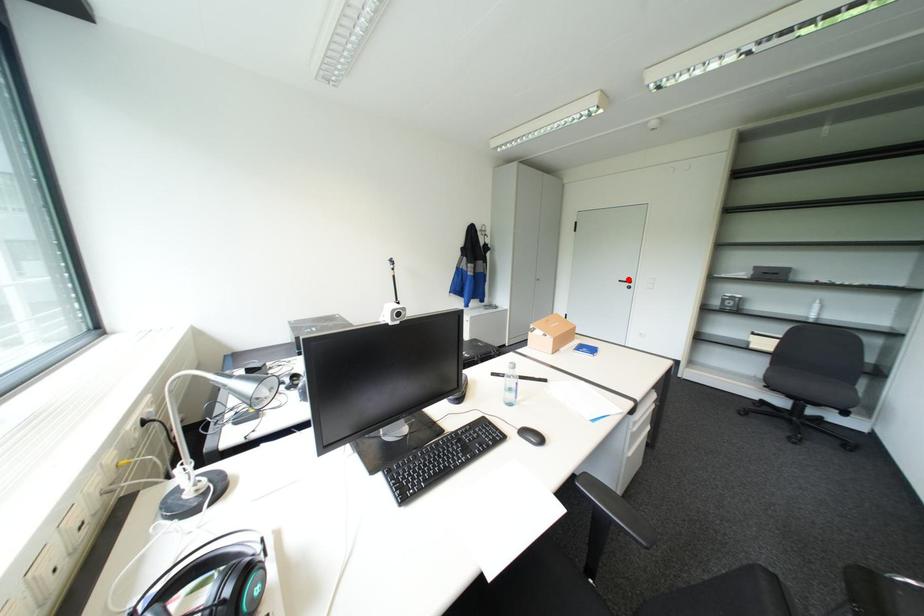
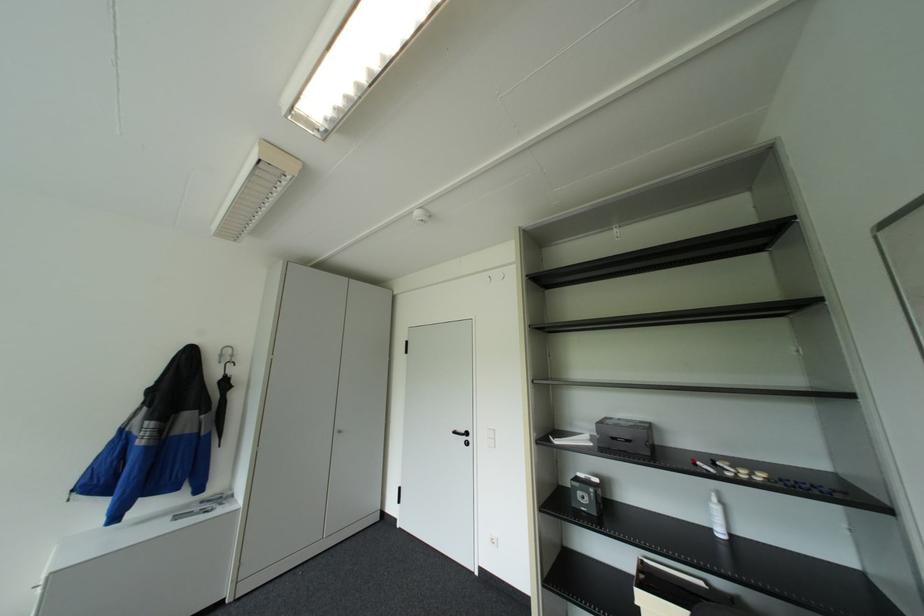
Question: I am providing you with two images of the same scene from different viewpoints. A red point is marked on the first image. At the location where the point appears in image 1, is it still visible in image 2?

Choices:
 (A) Yes
 (B) No

Answer: (A)